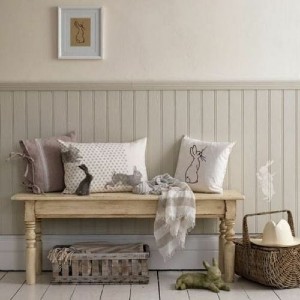
This screenshot has width=300, height=300. In order to click on white baseboard in this screenshot , I will do `click(197, 257)`.